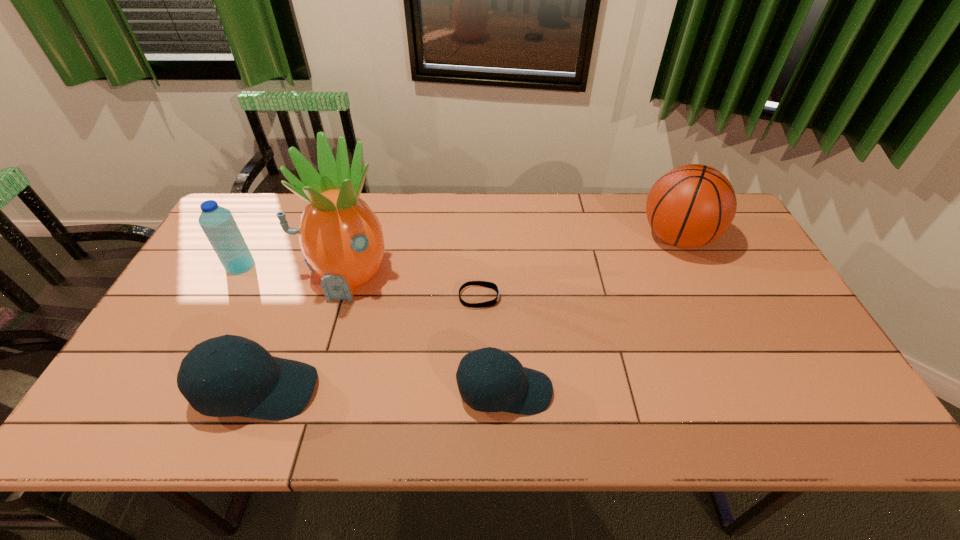
Please point out where to position a new baseball cap on the right to maintain spacing. Please provide its 2D coordinates. Your answer should be formatted as a tuple, i.e. [(x, y)], where the tuple contains the x and y coordinates of a point satisfying the conditions above.

[(751, 392)]